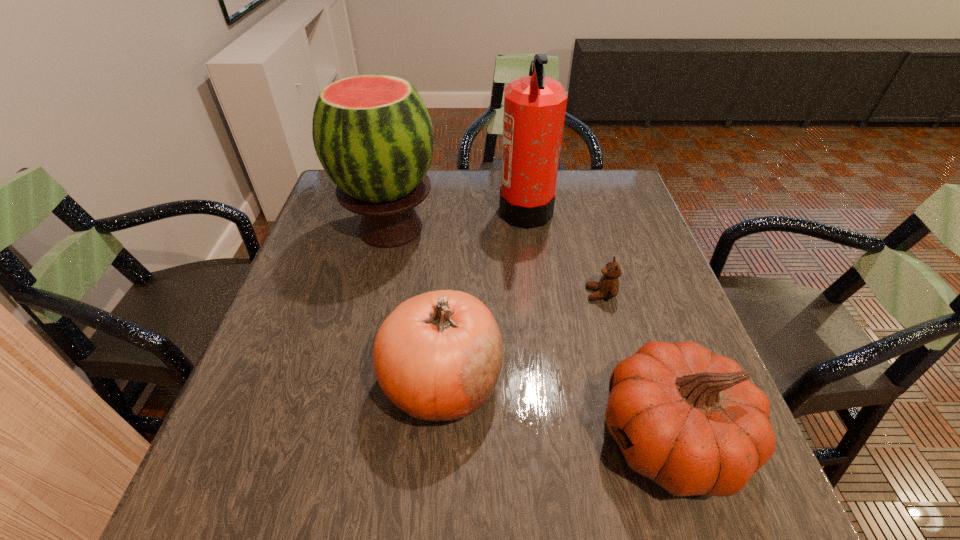
In order to click on object located in the near edge section of the desktop in this screenshot , I will do `click(691, 420)`.

Where is `object present at the left edge`? Image resolution: width=960 pixels, height=540 pixels. object present at the left edge is located at coordinates (373, 135).

Where is `pumpkin located at the right edge`? This screenshot has width=960, height=540. pumpkin located at the right edge is located at coordinates (691, 420).

Find the location of `teddy bear that is at the right edge`. teddy bear that is at the right edge is located at coordinates (608, 286).

The height and width of the screenshot is (540, 960). Identify the location of object that is positioned at the far left corner. (373, 135).

The width and height of the screenshot is (960, 540). I want to click on object that is at the near right corner, so click(691, 420).

The height and width of the screenshot is (540, 960). What are the coordinates of `free space at the far edge of the desktop` in the screenshot? It's located at (563, 197).

You are a GUI agent. You are given a task and a screenshot of the screen. Output one action in this format:
    pyautogui.click(x=<x>, y=<y>)
    Task: Click on the vacant space at the right edge of the desktop
    The width and height of the screenshot is (960, 540).
    Given the screenshot: What is the action you would take?
    pyautogui.click(x=630, y=254)

Find the location of a particular element. Image resolution: width=960 pixels, height=540 pixels. vacant space at the far left corner of the desktop is located at coordinates (336, 184).

Where is `vacant space at the near left corner of the desktop`? Image resolution: width=960 pixels, height=540 pixels. vacant space at the near left corner of the desktop is located at coordinates (198, 500).